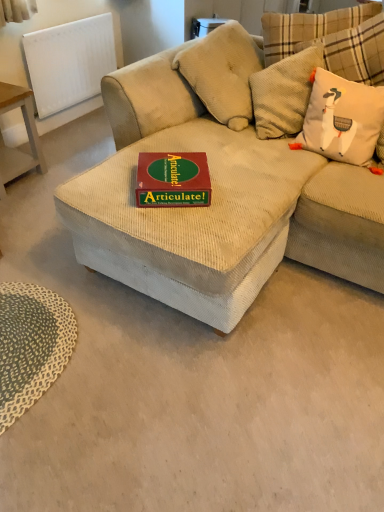
Locate an element on the screen. vacant area on top of white textured radiator at upper left (from a real-world perspective) is located at coordinates (68, 18).